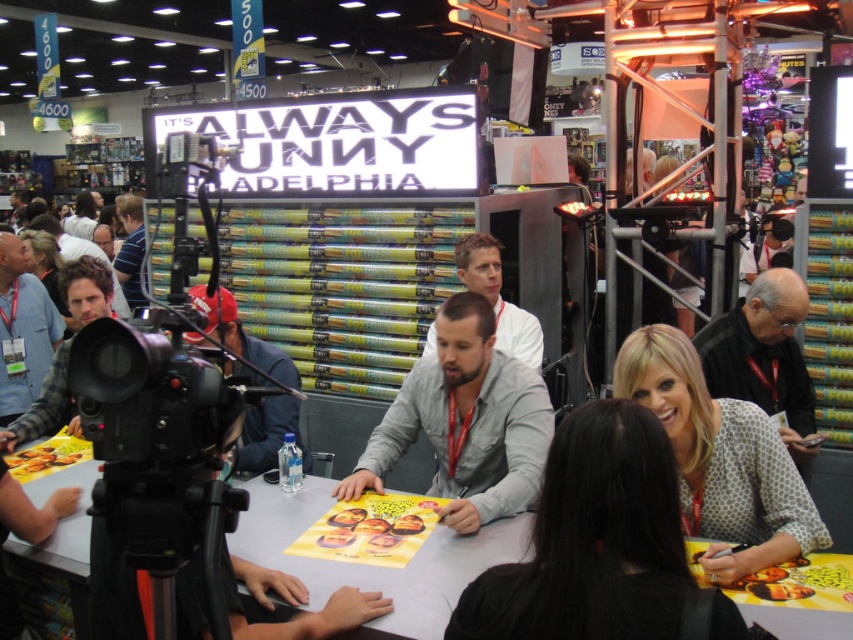
Question: Which point is farther to the camera?

Choices:
 (A) (758, 368)
 (B) (498, 316)

Answer: (B)

Question: Which point is farther to the camera?

Choices:
 (A) gray matte shirt at center
 (B) blue shirt at left
 (C) light gray shirt at center
 (D) plaid flannel shirt at left

Answer: (B)

Question: Estimate the real-world distances between objects in this image. Which object is farther from the gray matte shirt at center?

Choices:
 (A) plaid shirt at left
 (B) plaid flannel shirt at left
 (C) black matte shirt at center

Answer: (A)

Question: Can you confirm if plaid shirt at left is positioned above plaid flannel shirt at left?

Choices:
 (A) no
 (B) yes

Answer: (B)

Question: Does light gray shirt at center have a lesser width compared to blue shirt at left?

Choices:
 (A) no
 (B) yes

Answer: (B)

Question: Is the position of plaid shirt at left less distant than that of plaid flannel shirt at left?

Choices:
 (A) yes
 (B) no

Answer: (B)